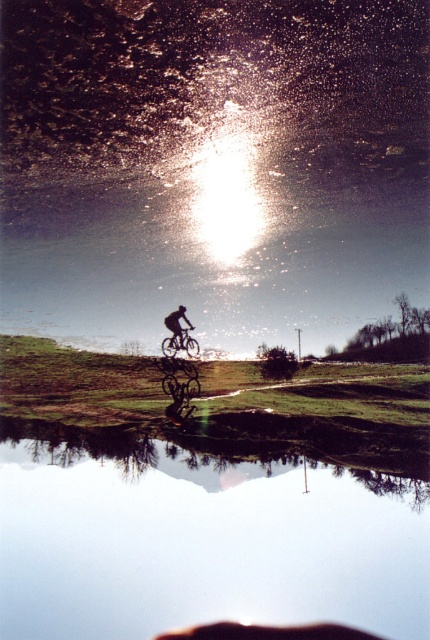
Who is shorter, transparent glass water at center or black matte bicycle at center?

Standing shorter between the two is black matte bicycle at center.

Between transparent glass water at center and black matte bicycle at center, which one appears on the left side from the viewer's perspective?

black matte bicycle at center is more to the left.

Is point (224, 458) farther from camera compared to point (172, 333)?

Yes, point (224, 458) is farther from viewer.

This screenshot has height=640, width=430. I want to click on transparent glass water at center, so pyautogui.click(x=203, y=532).

Does transparent glass water at center have a lesser height compared to shiny metallic bicycle at center?

In fact, transparent glass water at center may be taller than shiny metallic bicycle at center.

Between transparent glass water at center and shiny metallic bicycle at center, which one is positioned higher?

shiny metallic bicycle at center is higher up.

Find the location of a particular element. This screenshot has height=640, width=430. transparent glass water at center is located at coordinates coord(203,532).

Can you confirm if shiny metallic bicycle at center is taller than black matte bicycle at center?

Indeed, shiny metallic bicycle at center has a greater height compared to black matte bicycle at center.

Identify the location of shiny metallic bicycle at center. (178, 378).